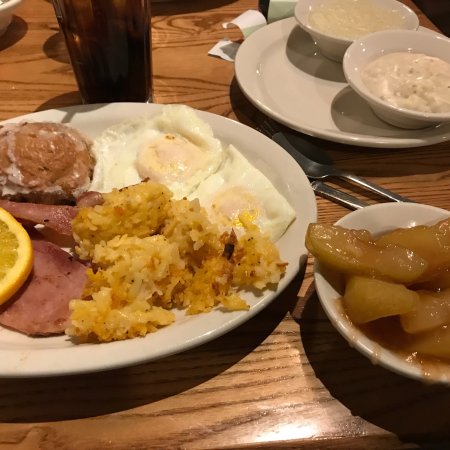
What are the coordinates of `plate` in the screenshot? It's located at (215, 321).